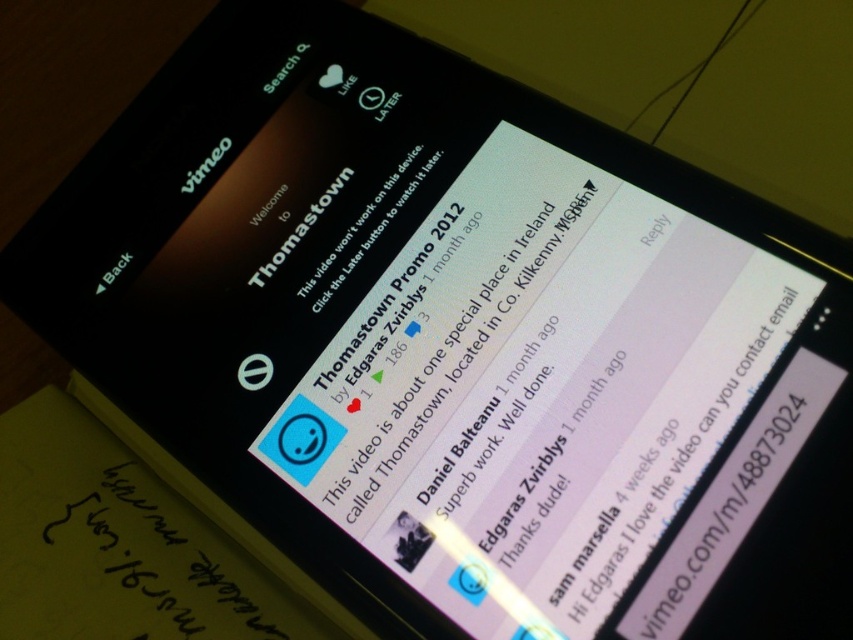
Question: Which of the following is the closest to the observer?

Choices:
 (A) (204, 548)
 (B) (518, 515)

Answer: (B)

Question: Which of the following is the farthest from the observer?

Choices:
 (A) (376, 532)
 (B) (102, 561)

Answer: (B)

Question: Does white matte text message at center appear under black paper at bottom left?

Choices:
 (A) yes
 (B) no

Answer: (B)

Question: Can you confirm if white matte text message at center is bigger than black paper at bottom left?

Choices:
 (A) no
 (B) yes

Answer: (B)

Question: Does white matte text message at center have a larger size compared to black paper at bottom left?

Choices:
 (A) no
 (B) yes

Answer: (B)